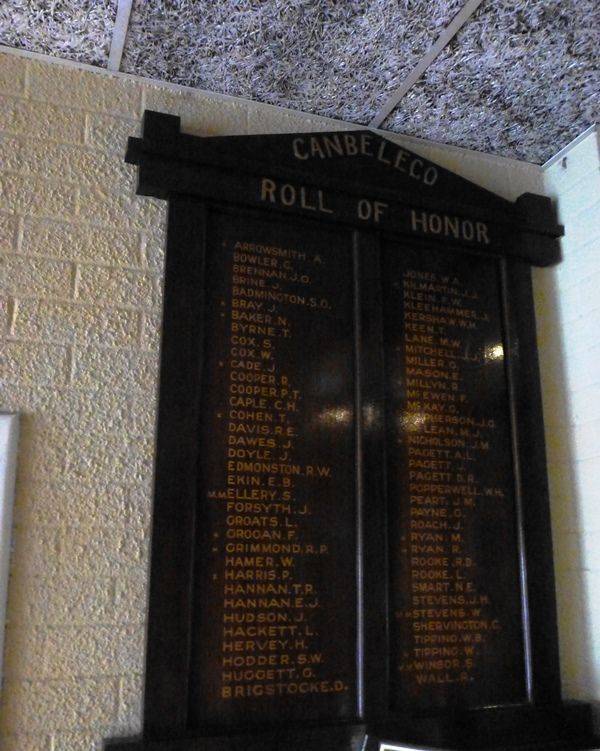
You are a GUI agent. You are given a task and a screenshot of the screen. Output one action in this format:
    pyautogui.click(x=<x>, y=<y>)
    Task: Click on the picture frame
    Image resolution: width=600 pixels, height=751 pixels.
    Given the screenshot: What is the action you would take?
    pyautogui.click(x=8, y=471)